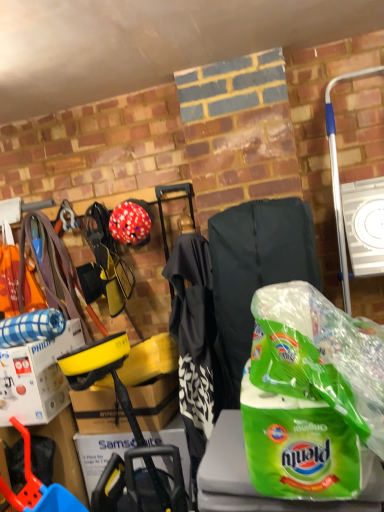
Question: From a real-world perspective, is green plastic bag at center positioned above or below white cardboard box at left?

Choices:
 (A) below
 (B) above

Answer: (B)

Question: Does point (319, 364) appear closer or farther from the camera than point (13, 401)?

Choices:
 (A) closer
 (B) farther

Answer: (A)

Question: Considering the real-world distances, which object is closest to the green plastic bag at center?

Choices:
 (A) white cardboard box at left
 (B) matte red helmet at center

Answer: (B)

Question: Considering the real-world distances, which object is closest to the green plastic bag at center?

Choices:
 (A) matte red helmet at center
 (B) white cardboard box at left

Answer: (A)